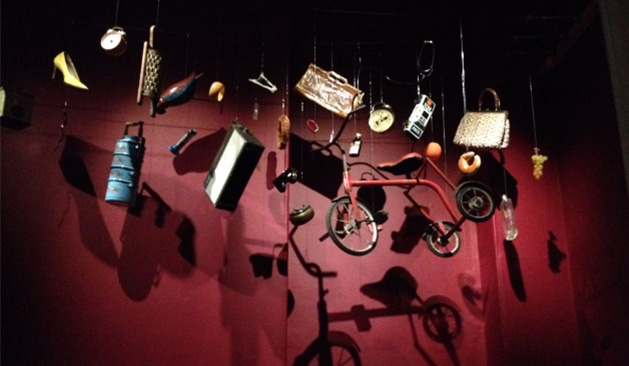
At what (x,y) coordinates should I click in order to perform the action: click on seat. Please return your answer as a coordinate pair (x, y). This screenshot has width=629, height=366. Looking at the image, I should click on point(402,162).